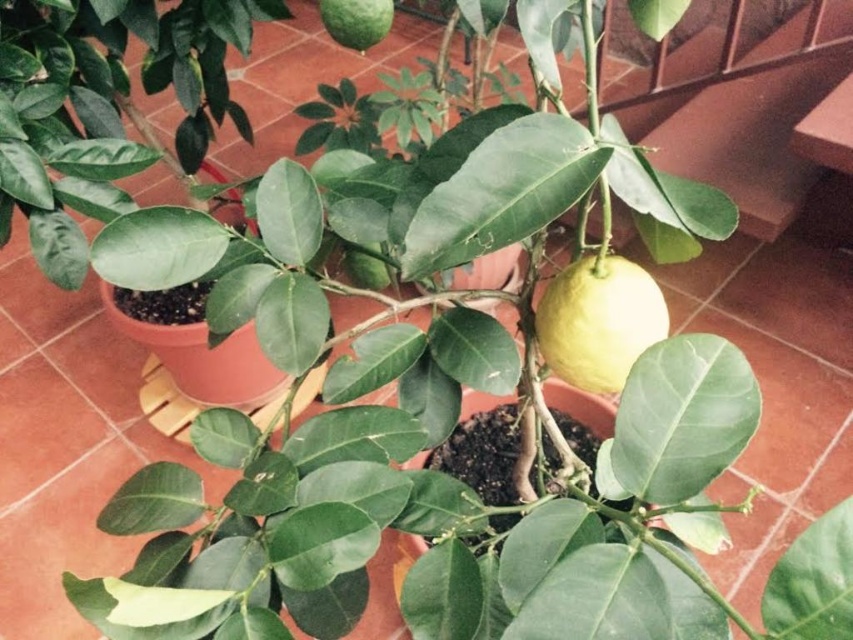
Is yellow matte lemon at center positioned in front of green matte lime at upper center?

Yes.

Which is below, yellow matte lemon at center or green matte lime at upper center?

yellow matte lemon at center

The height and width of the screenshot is (640, 853). I want to click on yellow matte lemon at center, so click(x=598, y=321).

What are the coordinates of `yellow matte lemon at center` in the screenshot? It's located at (598, 321).